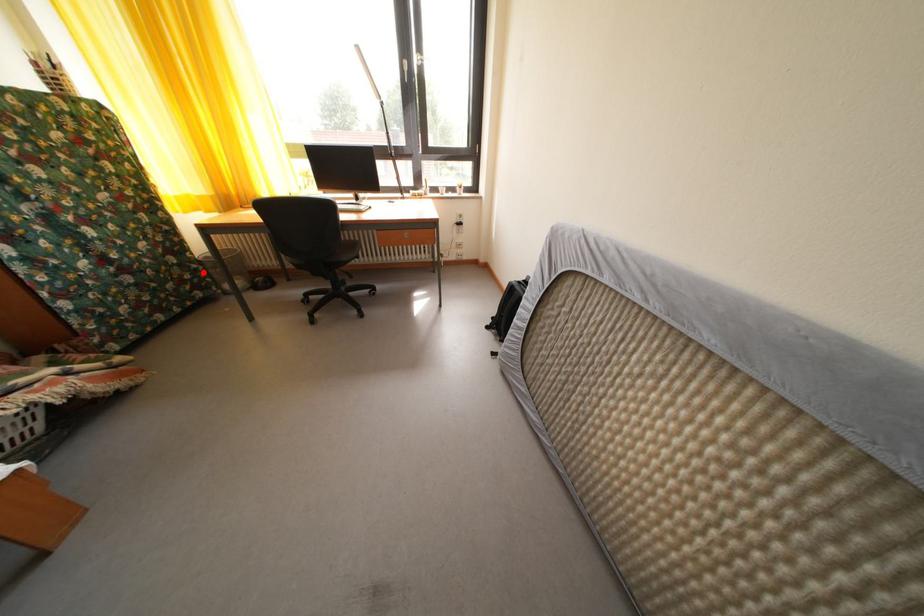
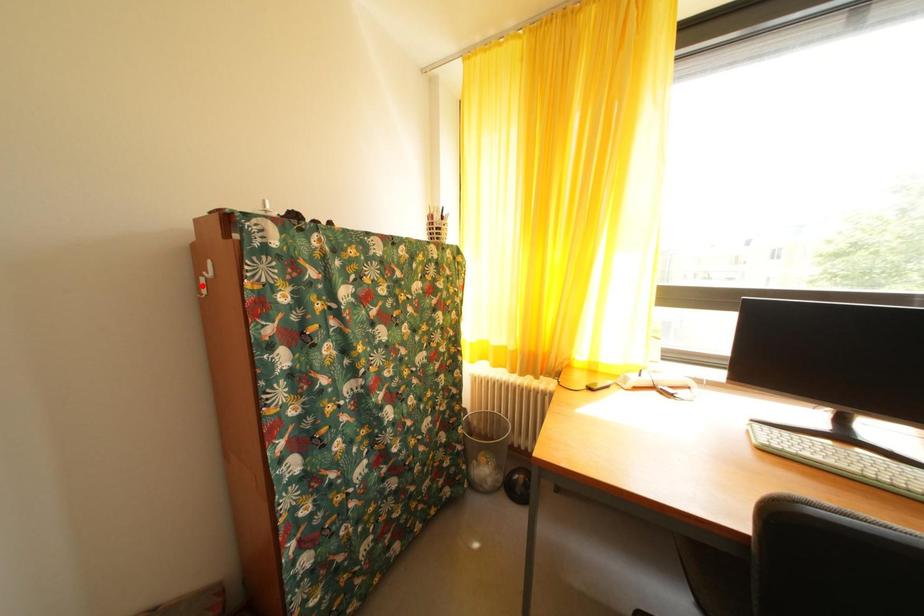
I am providing you with two images of the same scene from different viewpoints. A red point is marked on the first image and another point is marked on the second image. Do the highlighted points in image1 and image2 indicate the same real-world spot?

No